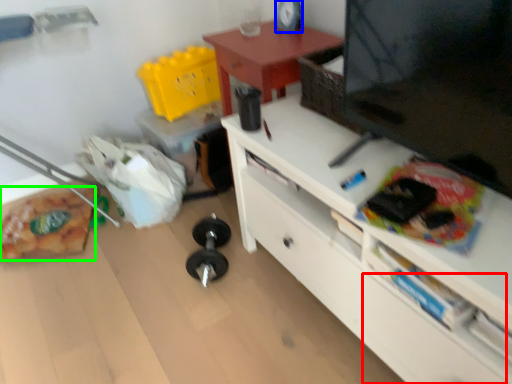
Question: Which object is positioned closest to drawer (highlighted by a red box)? Select from clock (highlighted by a blue box) and stuff (highlighted by a green box).

Choices:
 (A) clock
 (B) stuff

Answer: (A)